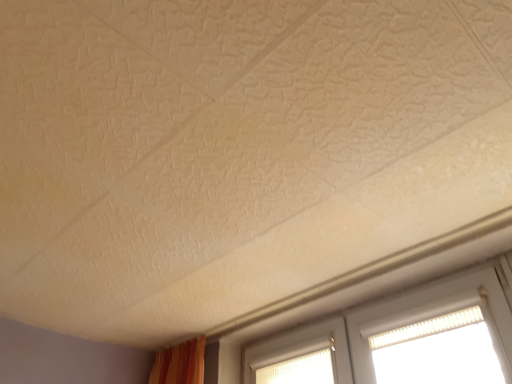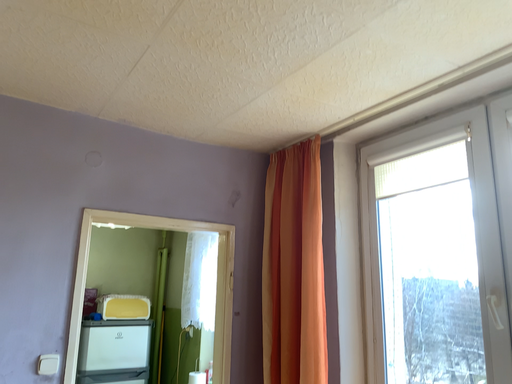
Question: Which way did the camera rotate in the video?

Choices:
 (A) rotated downward
 (B) rotated upward

Answer: (A)